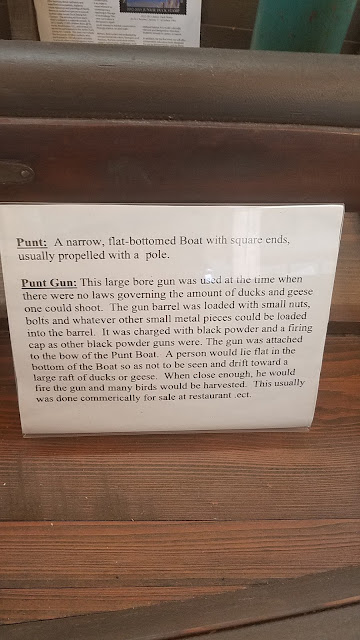
This screenshot has height=640, width=360. What are the coordinates of `wooden surface` in the screenshot? It's located at (176, 458), (231, 11).